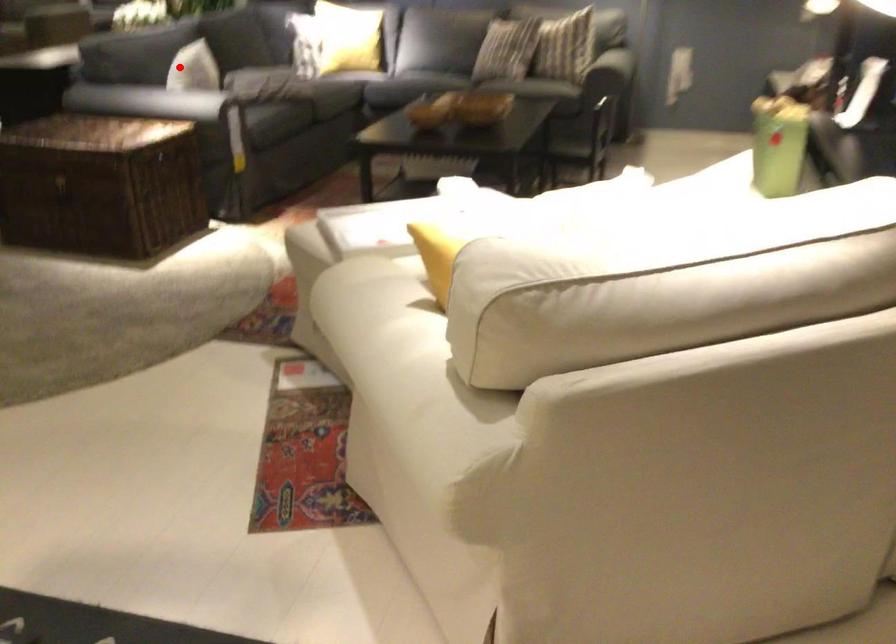
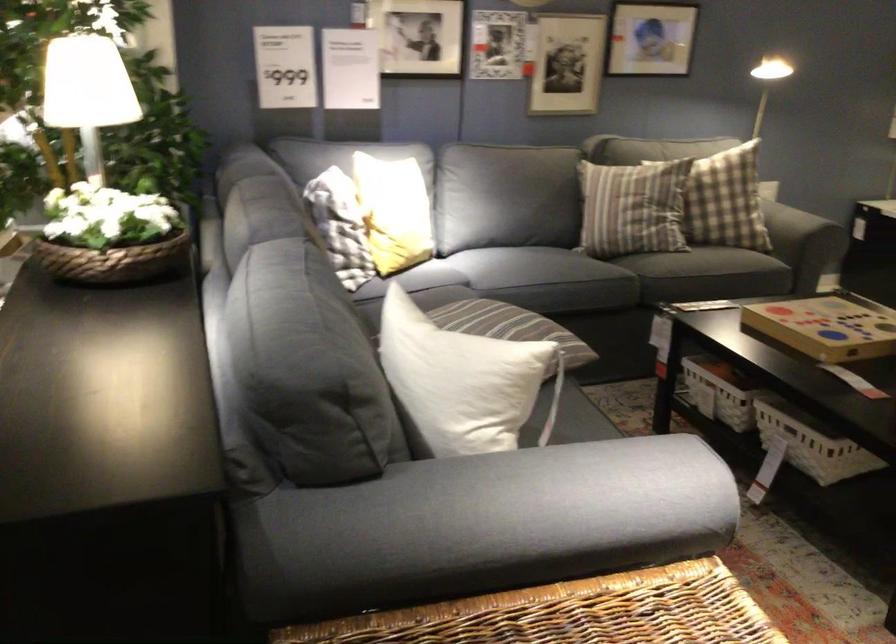
Question: I am providing you with two images of the same scene from different viewpoints. Given a red point in image1, look at the same physical point in image2. Is it:

Choices:
 (A) Closer to the viewpoint
 (B) Farther from the viewpoint

Answer: (A)